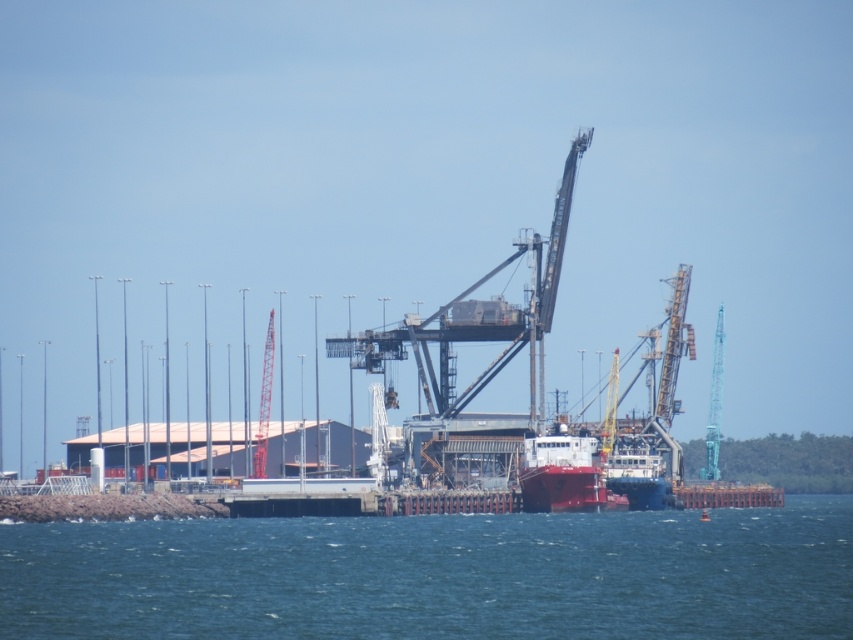
Looking at this image, is blue water at lower center to the right of smooth red ship at center from the viewer's perspective?

No, blue water at lower center is not to the right of smooth red ship at center.

Between blue water at lower center and smooth red ship at center, which one has more height?

smooth red ship at center is taller.

Is point (755, 596) closer to viewer compared to point (601, 481)?

That is True.

At what (x,y) coordinates should I click in order to perform the action: click on blue water at lower center. Please return your answer as a coordinate pair (x, y). The height and width of the screenshot is (640, 853). Looking at the image, I should click on (437, 576).